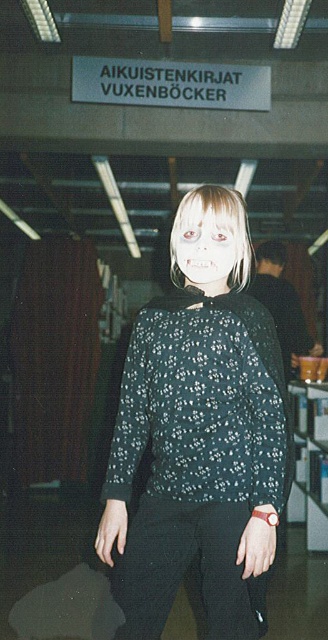
You are standing in the library section labeled for adult books. You notice two points marked in the scene. Which point is closer to you, point 1 at coordinates [175,557] or point 2 at coordinates [202,243]?

Point 2 at coordinates [202,243] is closer to you because the description states that point 1 is further to the camera than point 2.

You are a photographer trying to capture a portrait of the person in the scene. The camera you are using has a minimum focusing distance of 8 inches. Can you take a clear photo of both the black floral blouse at center and the white matte face at center without moving the camera or the subject?

The black floral blouse at center and white matte face at center are 8.52 inches apart from each other. Since the minimum focusing distance is 8 inches, the camera can focus on both objects as the distance between them is within the focusing range.